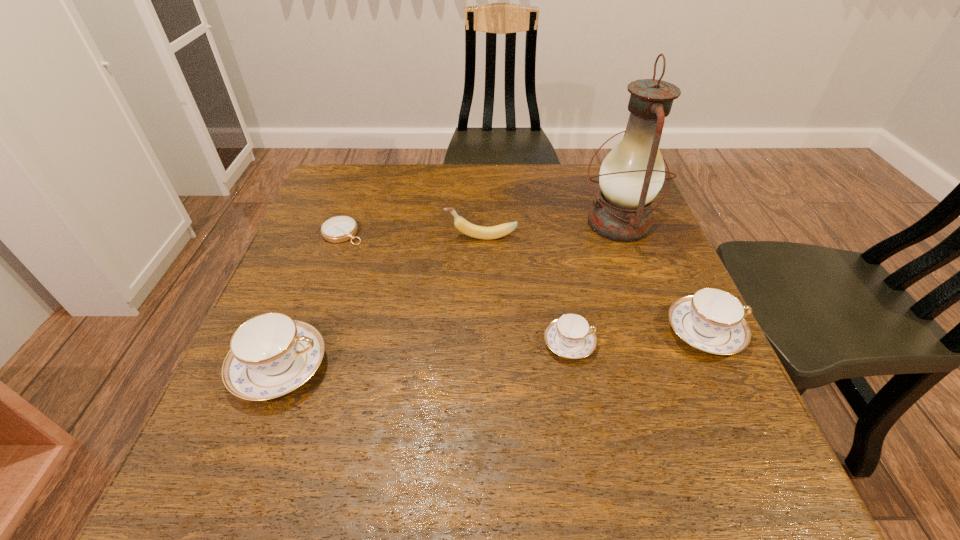
The image size is (960, 540). I want to click on blank region between the leftmost teacup and the oil lamp, so click(x=449, y=295).

The width and height of the screenshot is (960, 540). I want to click on blank region between the shortest teacup and the third object from left to right, so click(525, 290).

Find the location of `vacant area that lies between the third object from left to right and the compass`. vacant area that lies between the third object from left to right and the compass is located at coordinates (412, 235).

Locate an element on the screen. The height and width of the screenshot is (540, 960). unoccupied area between the third object from right to left and the shortest object is located at coordinates (456, 288).

This screenshot has height=540, width=960. I want to click on vacant area that lies between the compass and the leftmost teacup, so click(x=311, y=300).

The width and height of the screenshot is (960, 540). I want to click on unoccupied position between the leftmost teacup and the tallest object, so [x=449, y=295].

Identify which object is located as the nearest to the compass. Please provide its 2D coordinates. Your answer should be formatted as a tuple, i.e. [(x, y)], where the tuple contains the x and y coordinates of a point satisfying the conditions above.

[(486, 233)]

You are a GUI agent. You are given a task and a screenshot of the screen. Output one action in this format:
    pyautogui.click(x=<x>, y=<y>)
    Task: Click on the fifth closest object relative to the second shortest teacup
    This screenshot has width=960, height=540.
    Given the screenshot: What is the action you would take?
    pyautogui.click(x=338, y=229)

Find the location of `teacup that can be found as the closest to the leftmost teacup`. teacup that can be found as the closest to the leftmost teacup is located at coordinates [570, 336].

Locate an element on the screen. teacup that stands as the third closest to the tallest object is located at coordinates (270, 355).